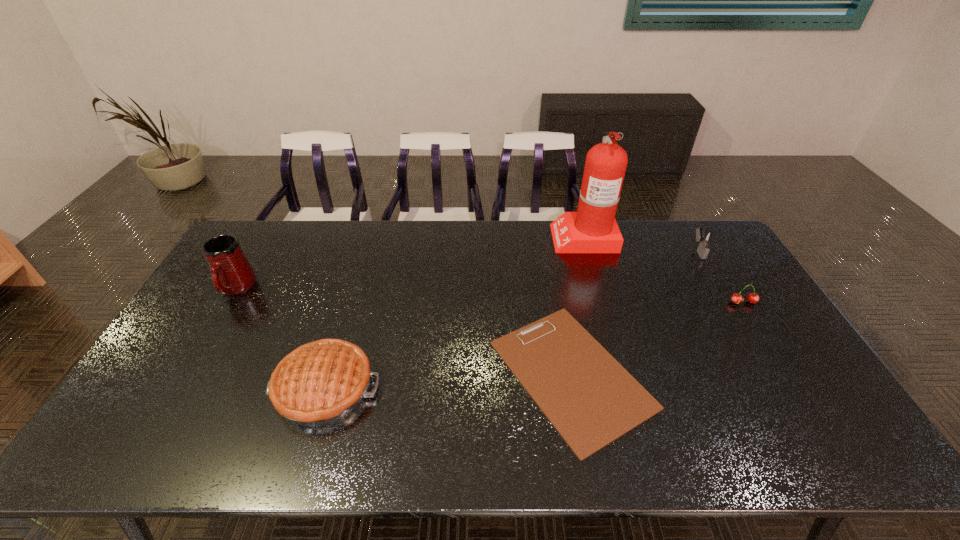
At what (x,y) coordinates should I click in order to perform the action: click on fire extinguisher. Please return your answer as a coordinate pair (x, y). Looking at the image, I should click on (592, 229).

This screenshot has width=960, height=540. I want to click on the leftmost object, so click(x=232, y=274).

At what (x,y) coordinates should I click in order to perform the action: click on mug. Please return your answer as a coordinate pair (x, y). Looking at the image, I should click on (232, 274).

Find the location of a particular element. This screenshot has width=960, height=540. igniter is located at coordinates (705, 238).

Identify the location of the second object from left to right. This screenshot has height=540, width=960. (321, 382).

Identify the location of the fifth tallest object. This screenshot has height=540, width=960. (736, 298).

The height and width of the screenshot is (540, 960). I want to click on the shortest object, so click(x=588, y=396).

Image resolution: width=960 pixels, height=540 pixels. Identify the location of vacant space positioned on the front-facing side of the fire extinguisher. (455, 236).

Find the location of a particular element. The width and height of the screenshot is (960, 540). blank space located on the front-facing side of the fire extinguisher is located at coordinates (498, 236).

The height and width of the screenshot is (540, 960). What are the coordinates of `vacant space located on the front-facing side of the fire extinguisher` in the screenshot? It's located at (493, 236).